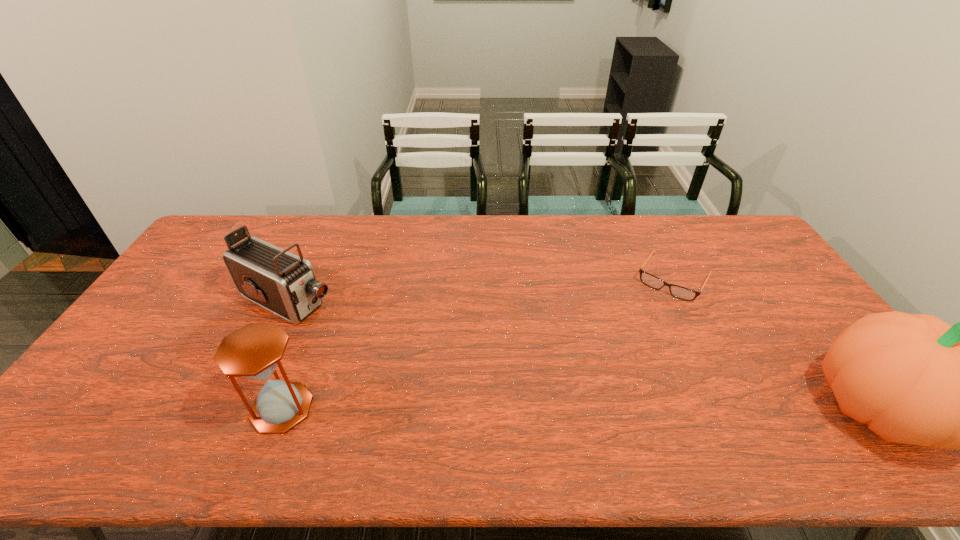
Locate an element on the screen. hourglass is located at coordinates (254, 351).

Locate an element on the screen. spectacles is located at coordinates (683, 293).

Find the location of a particular element. Image resolution: width=960 pixels, height=540 pixels. the shortest object is located at coordinates (683, 293).

In order to click on camcorder in this screenshot , I will do `click(285, 284)`.

This screenshot has height=540, width=960. Identify the location of free spot located on the left of the hourglass. (213, 408).

Find the location of a particular element. vacant position located on the front-facing side of the third object from left to right is located at coordinates (639, 335).

Where is `free region located 0.270m on the front-facing side of the third object from left to right`? The image size is (960, 540). free region located 0.270m on the front-facing side of the third object from left to right is located at coordinates (628, 355).

The height and width of the screenshot is (540, 960). Find the location of `free space located on the front-facing side of the third object from left to right`. free space located on the front-facing side of the third object from left to right is located at coordinates (642, 331).

Image resolution: width=960 pixels, height=540 pixels. In order to click on vacant space situated 0.170m at the lens of the camcorder in this screenshot , I will do `click(372, 335)`.

Locate an element on the screen. The image size is (960, 540). free space located 0.250m at the lens of the camcorder is located at coordinates (394, 347).